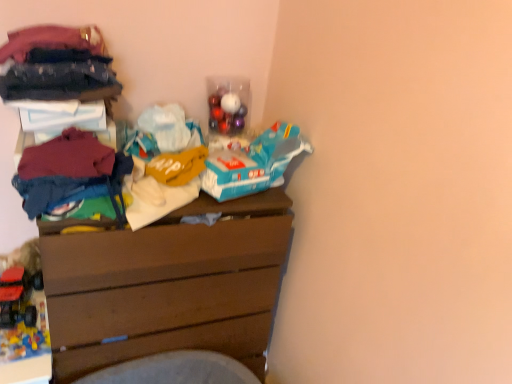
Identify the location of free spot above rubberized plastic toy truck at lower left, positioned as the 1th toy in bottom-to-top order (from a real-world perspective). This screenshot has width=512, height=384. (18, 328).